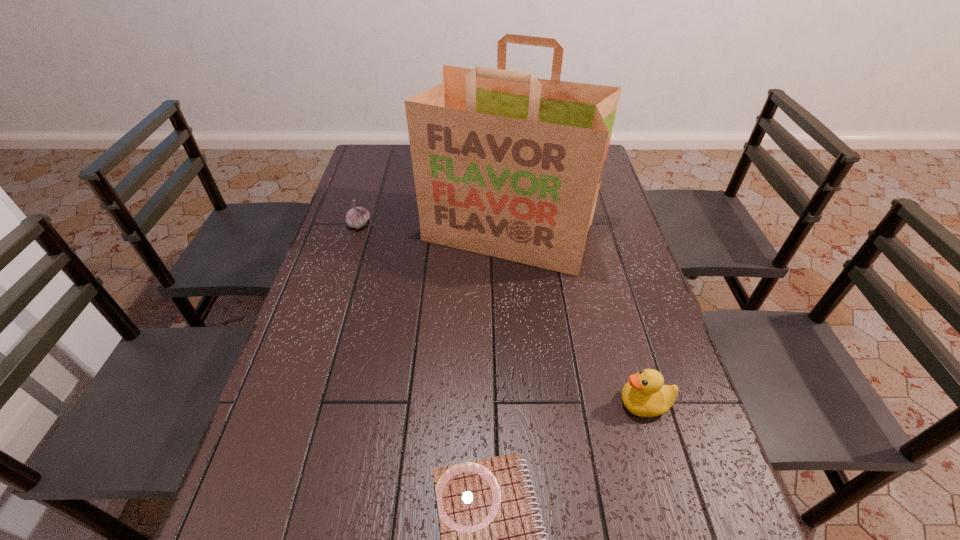
Identify the location of grocery bag. (507, 165).

This screenshot has height=540, width=960. Identify the location of the third shortest object. (645, 395).

The height and width of the screenshot is (540, 960). Identify the location of the third farthest object. (645, 395).

You are a GUI agent. You are given a task and a screenshot of the screen. Output one action in this format:
    pyautogui.click(x=<x>, y=<y>)
    Task: Click on the leftmost object
    This screenshot has width=960, height=540.
    Given the screenshot: What is the action you would take?
    pyautogui.click(x=357, y=217)

What are the coordinates of `the second shortest object` in the screenshot? It's located at (357, 217).

You are a GUI agent. You are given a task and a screenshot of the screen. Output one action in this format:
    pyautogui.click(x=<x>, y=<y>)
    Task: Click on the free space located on the front of the tallest object
    
    Given the screenshot: What is the action you would take?
    point(518,385)

The width and height of the screenshot is (960, 540). In order to click on vacant area situated 0.340m at the beak of the third farthest object in this screenshot , I will do `click(461, 403)`.

Locate an element on the screen. vacant position located 0.310m at the beak of the third farthest object is located at coordinates (475, 403).

Identify the location of vacant space situated 0.160m at the beak of the third farthest object. The width and height of the screenshot is (960, 540). (544, 403).

Identify the location of vacant region located on the front of the leftmost object. (344, 274).